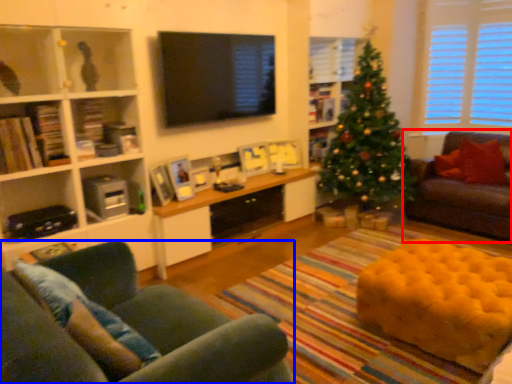
Question: Which point is further to the camera, studio couch (highlighted by a red box) or studio couch (highlighted by a blue box)?

Choices:
 (A) studio couch
 (B) studio couch

Answer: (A)